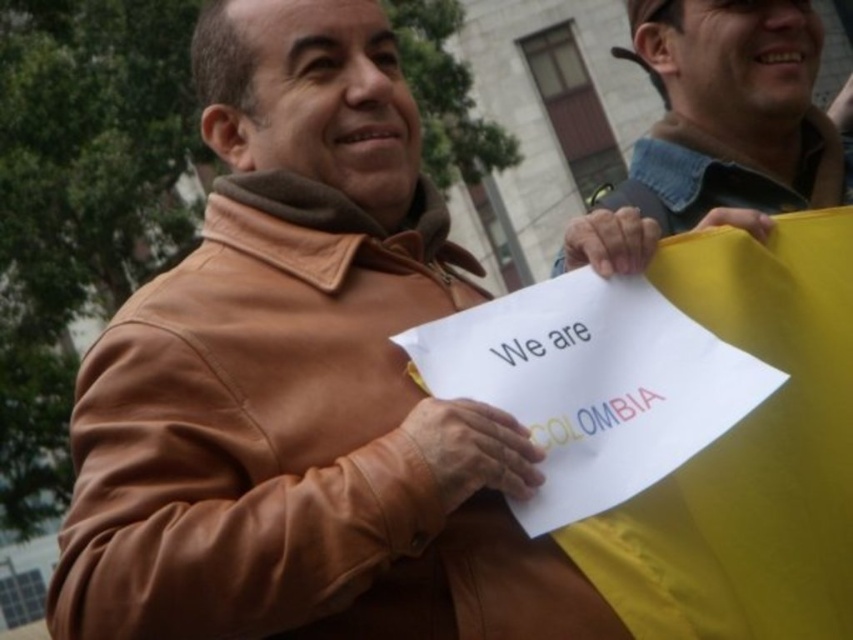
Question: Among these objects, which one is nearest to the camera?

Choices:
 (A) denim jacket at upper right
 (B) brown leather jacket at center

Answer: (B)

Question: Can you confirm if brown leather jacket at center is thinner than denim jacket at upper right?

Choices:
 (A) yes
 (B) no

Answer: (B)

Question: Does brown leather jacket at center come in front of denim jacket at upper right?

Choices:
 (A) yes
 (B) no

Answer: (A)

Question: Which object appears closest to the camera in this image?

Choices:
 (A) denim jacket at upper right
 (B) brown leather jacket at center

Answer: (B)

Question: Is brown leather jacket at center closer to camera compared to denim jacket at upper right?

Choices:
 (A) no
 (B) yes

Answer: (B)